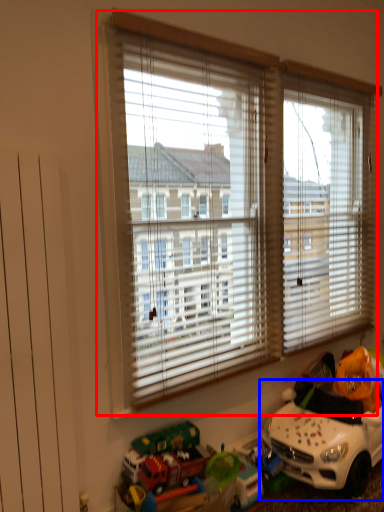
Question: Which object appears closest to the camera in this image, window (highlighted by a red box) or toy (highlighted by a blue box)?

Choices:
 (A) window
 (B) toy

Answer: (A)